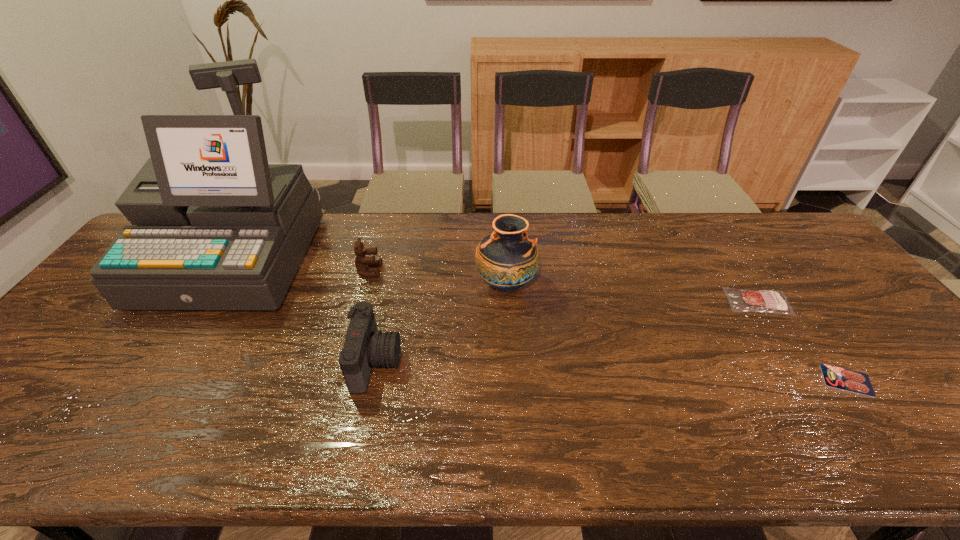
Locate an element on the screen. The image size is (960, 540). free space at the left edge of the desktop is located at coordinates (18, 404).

What are the coordinates of `free space between the tallest object and the teddy bear` in the screenshot? It's located at (302, 264).

You are a GUI agent. You are given a task and a screenshot of the screen. Output one action in this format:
    pyautogui.click(x=<x>, y=<y>)
    Task: Click on the blank region between the teddy bear and the leftmost object
    This screenshot has width=960, height=540.
    Given the screenshot: What is the action you would take?
    pyautogui.click(x=302, y=264)

Find the location of a particular element. This screenshot has height=540, width=960. free area in between the second shortest object and the salami is located at coordinates point(803,341).

You are a GUI agent. You are given a task and a screenshot of the screen. Output one action in this format:
    pyautogui.click(x=<x>, y=<y>)
    Task: Click on the empty space between the salami and the steak
    This screenshot has height=540, width=960.
    Given the screenshot: What is the action you would take?
    pyautogui.click(x=803, y=341)

At what (x,y) coordinates should I click in order to perform the action: click on free space between the fifth tallest object and the salami. Please return your answer as a coordinate pair (x, y). The width and height of the screenshot is (960, 540). Looking at the image, I should click on (803, 341).

Locate an element on the screen. This screenshot has height=540, width=960. free area in between the camera and the steak is located at coordinates (567, 332).

Identify the location of free spot between the teddy bear and the fifth tallest object. This screenshot has height=540, width=960. (564, 286).

Where is `empty space that is in between the teddy bear and the pottery`? The image size is (960, 540). empty space that is in between the teddy bear and the pottery is located at coordinates (438, 278).

Where is `free space between the cash register and the camera`? The width and height of the screenshot is (960, 540). free space between the cash register and the camera is located at coordinates (305, 310).